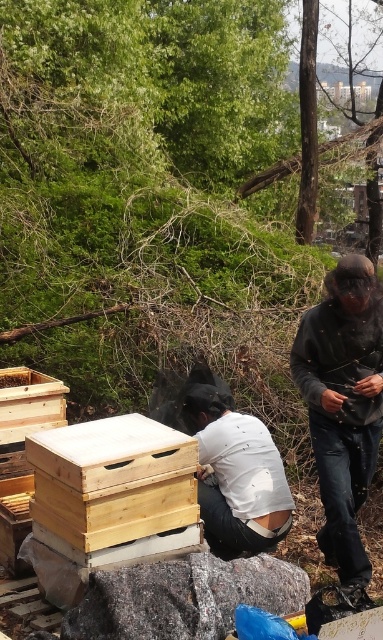
Which is in front, point (356, 416) or point (54, 496)?

Point (54, 496) is more forward.

Can you confirm if dark gray fleece jacket at right is shorter than light brown wooden beehive at center?

In fact, dark gray fleece jacket at right may be taller than light brown wooden beehive at center.

Which is in front, point (345, 381) or point (180, 433)?

Point (180, 433) is in front.

Where is `dark gray fleece jacket at right`? dark gray fleece jacket at right is located at coordinates (343, 404).

Is light brown wooden beehive at center further to camera compared to white matte shirt at center?

No, it is not.

Does light brown wooden beehive at center have a lesser width compared to white matte shirt at center?

No.

Identify the location of light brown wooden beehive at center. This screenshot has height=640, width=383. (112, 481).

Locate an element on the screen. This screenshot has height=640, width=383. light brown wooden beehive at center is located at coordinates (112, 481).

Can you confirm if dark gray fleece jacket at right is smaller than white matte shirt at center?

No.

Is dark gray fleece jacket at right bigger than white matte shirt at center?

Correct, dark gray fleece jacket at right is larger in size than white matte shirt at center.

In order to click on dark gray fleece jacket at right in this screenshot , I will do `click(343, 404)`.